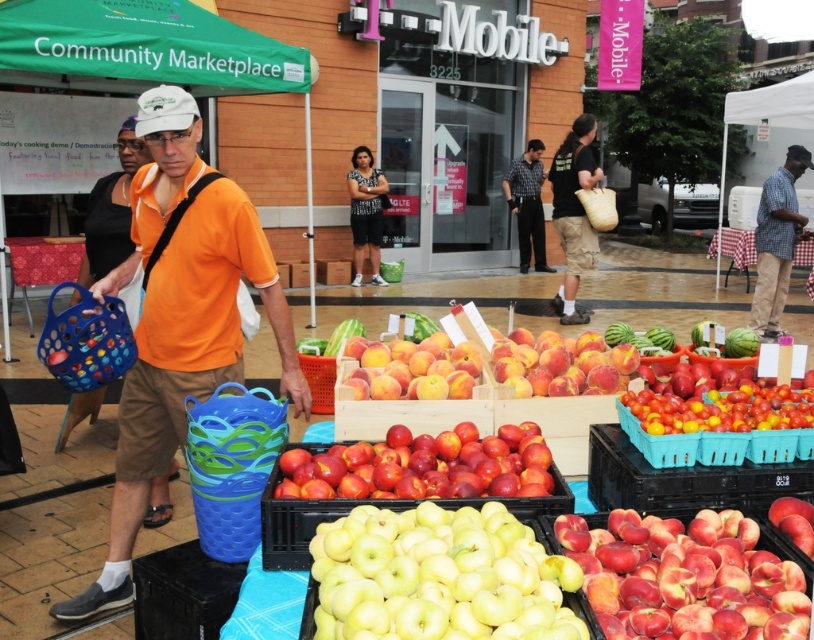
In the scene shown: You are a customer at the market and want to buy both the shiny red tomatoes at center and the matte plastic crate of apples at center. Which one is on top of the other?

The shiny red tomatoes at center is positioned over the matte plastic crate of apples at center, so the tomatoes are on top of the crate.

You are a customer at the market and want to find the matte plastic crate of apples at center. If you are standing at the origin point of the coordinate system, which direction should you move to reach it?

The matte plastic crate of apples at center is located at coordinate point 0.819 on the x axis and 0.371 on the y axis. Since the origin is at the bottom left corner of the image, you should move to the right and slightly forward to reach it.